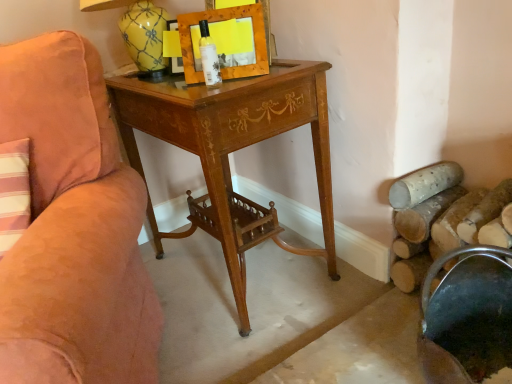
The height and width of the screenshot is (384, 512). What are the coordinates of `vacant position to the left of clear glass bottle at center` in the screenshot? It's located at (174, 87).